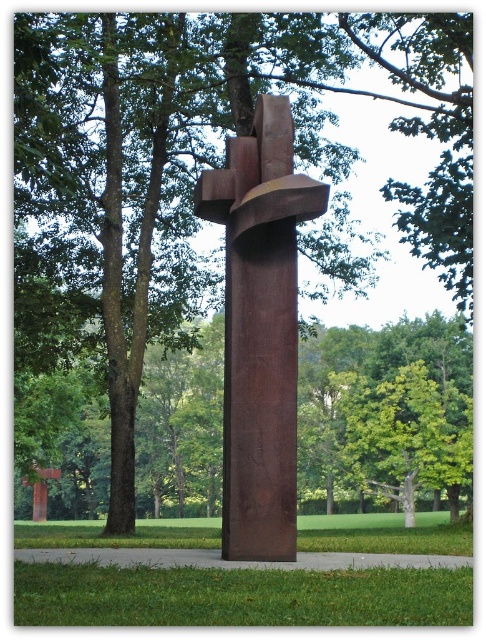
You are a photographer standing in the park and want to capture both the rusty metal sculpture at center and the rusty metal cross at lower left in a single photo. Based on their positions, which one will appear higher in the frame?

The rusty metal sculpture at center is positioned above the rusty metal cross at lower left, so it will appear higher in the frame.

You are an art student trying to take a photo of the rusty metal sculpture at center from the rusty metal cross at lower left. Considering the distance between them, will you need a telephoto lens to capture the entire sculpture in your shot?

The distance between the rusty metal sculpture at center and the rusty metal cross at lower left is 39.85 meters. To capture the entire sculpture from that distance, you would likely need a telephoto lens to ensure the sculpture fills the frame appropriately.

You are standing in the park and see the rusty metal sculpture at center and the rusty metal cross at lower left. Which one is positioned to the right side of the other?

The rusty metal sculpture at center is positioned to the right of the rusty metal cross at lower left.